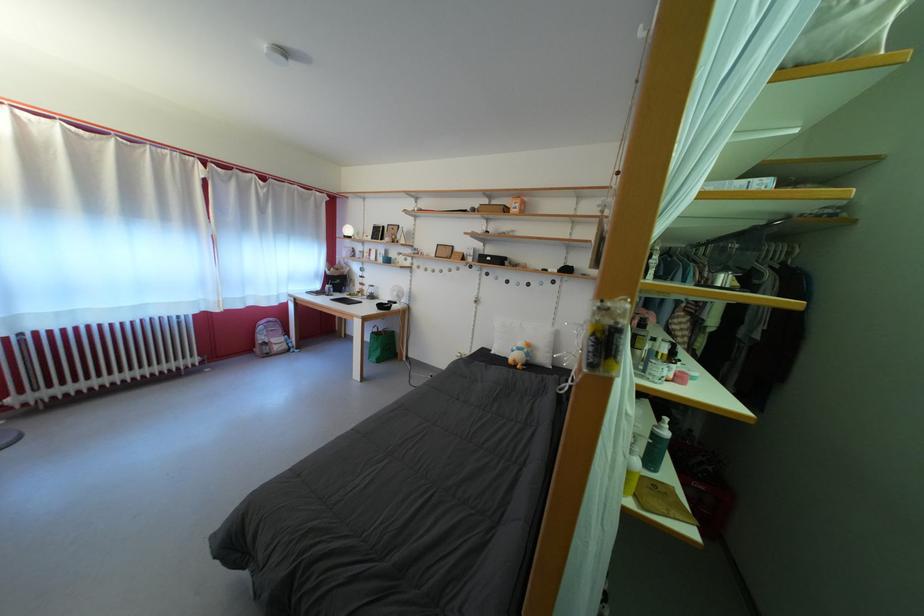
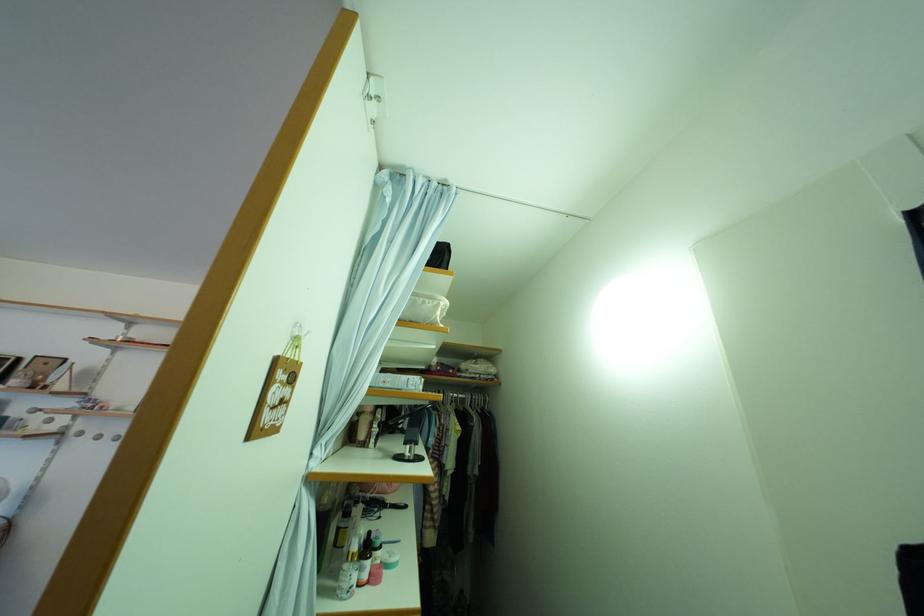
Where in the second image is the point corresponding to point 687,367 from the first image?

(390, 554)